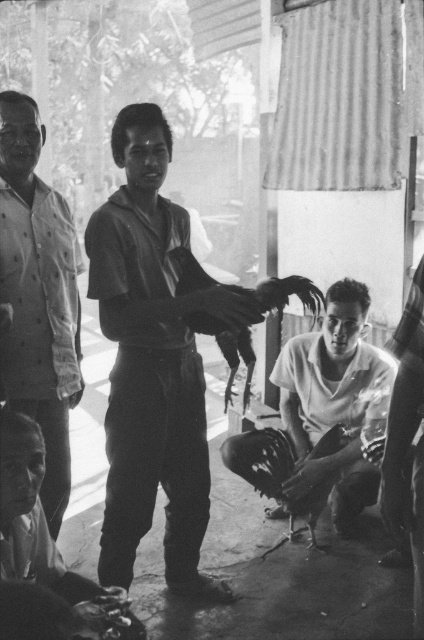
Question: Is light gray button-up shirt at left smaller than smooth white shirt at center?

Choices:
 (A) no
 (B) yes

Answer: (B)

Question: Which object is farther from the camera taking this photo?

Choices:
 (A) smooth black shirt at center
 (B) smooth white shirt at center
 (C) light gray button-up shirt at left

Answer: (B)

Question: Estimate the real-world distances between objects in this image. Which object is closer to the smooth white shirt at center?

Choices:
 (A) light gray button-up shirt at left
 (B) smooth black shirt at center

Answer: (B)

Question: Is smooth black shirt at center bigger than smooth white shirt at center?

Choices:
 (A) yes
 (B) no

Answer: (A)

Question: Which object is positioned farthest from the smooth white shirt at center?

Choices:
 (A) smooth black shirt at center
 (B) light gray button-up shirt at left

Answer: (B)

Question: Does light gray button-up shirt at left appear on the left side of smooth white shirt at center?

Choices:
 (A) no
 (B) yes

Answer: (B)